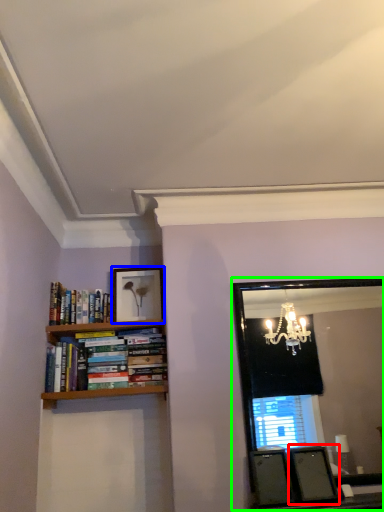
Question: Which object is the closest to the picture frame (highlighted by a red box)? Choose among these: picture frame (highlighted by a blue box) or mirror (highlighted by a green box).

Choices:
 (A) picture frame
 (B) mirror

Answer: (A)